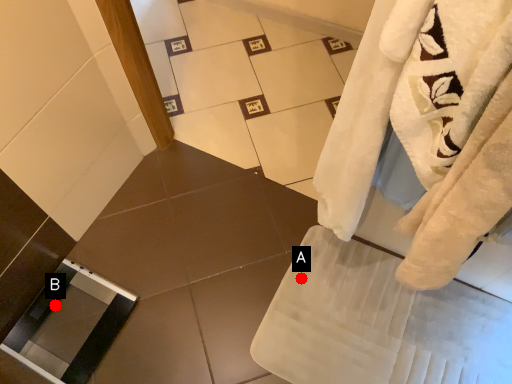
Question: Two points are circled on the image, labeled by A and B beside each circle. Which of the following is the farthest from the observer?

Choices:
 (A) A is further
 (B) B is further

Answer: (A)